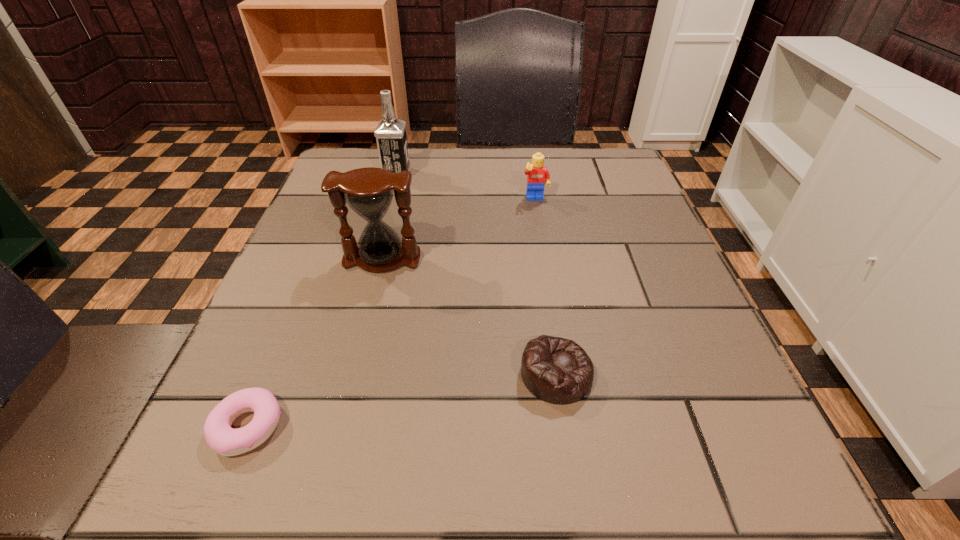
Where is `unoccupied position between the farthest object and the third nearest object`? unoccupied position between the farthest object and the third nearest object is located at coordinates point(390,217).

Identify the location of free point between the beanbag and the third shortest object. (546, 287).

Locate an element on the screen. This screenshot has width=960, height=540. vacant space in between the shortest object and the vodka is located at coordinates (323, 301).

I want to click on vacant space that's between the farthest object and the hourglass, so click(390, 217).

You are a GUI agent. You are given a task and a screenshot of the screen. Output one action in this format:
    pyautogui.click(x=<x>, y=<y>)
    Task: Click on the free area in between the vodka and the second farthest object
    
    Given the screenshot: What is the action you would take?
    pyautogui.click(x=467, y=187)

Locate an element on the screen. empty location between the third nearest object and the beanbag is located at coordinates (469, 316).

Find the location of a particular element. This screenshot has height=540, width=960. free spot between the vodka and the hourglass is located at coordinates (390, 217).

Identify the location of vacant point located between the hourglass and the second farthest object. (459, 230).

Select which object is the third closest to the third nearest object. Please provide its 2D coordinates. Your answer should be formatted as a tuple, i.e. [(x, y)], where the tuple contains the x and y coordinates of a point satisfying the conditions above.

[(537, 173)]

Identify the location of object that is the closest to the fourth tallest object. (369, 192).